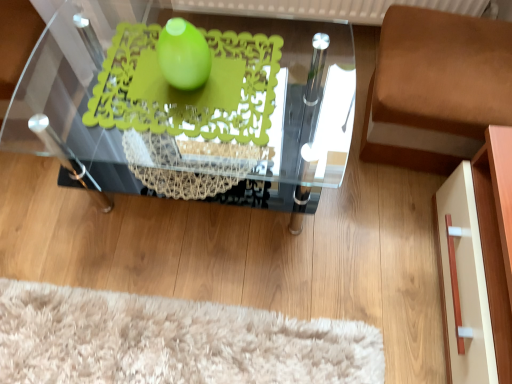
The height and width of the screenshot is (384, 512). In order to click on free point above transparent glass table at center (from a real-world perspective) in this screenshot , I will do `click(179, 92)`.